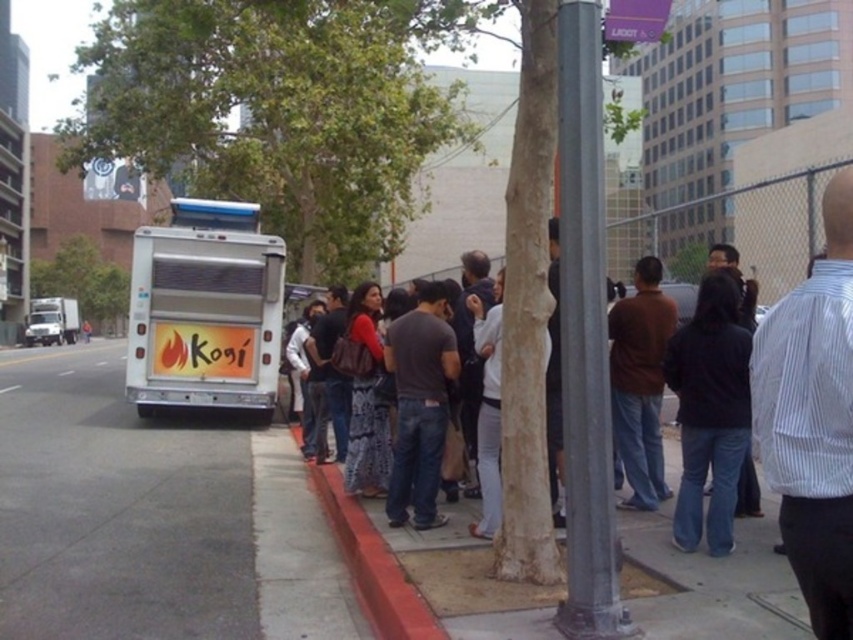
Question: Which of the following is the farthest from the observer?

Choices:
 (A) (76, 272)
 (B) (822, 589)
 (C) (583, 218)

Answer: (A)

Question: Which point is closer to the camera taking this photo?

Choices:
 (A) (180, 252)
 (B) (746, 442)

Answer: (B)

Question: From the image, what is the correct spatial relationship of green leafy tree at upper left in relation to green leafy tree at left?

Choices:
 (A) above
 (B) below

Answer: (A)

Question: Which object is farther from the camera taking this photo?

Choices:
 (A) green leafy tree at left
 (B) dark gray t-shirt at center
 (C) gray metallic pole at center
 (D) metallic silver food truck at left

Answer: (A)

Question: Is white striped shirt at center wider than red printed dress at center?

Choices:
 (A) yes
 (B) no

Answer: (B)

Question: In this image, where is red printed dress at center located relative to white matte food truck at left?

Choices:
 (A) below
 (B) above

Answer: (A)